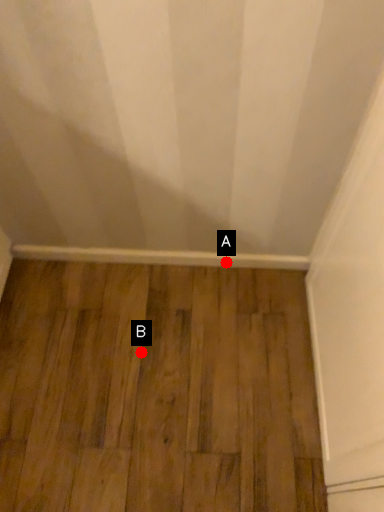
Question: Two points are circled on the image, labeled by A and B beside each circle. Among these points, which one is nearest to the camera?

Choices:
 (A) A is closer
 (B) B is closer

Answer: (B)